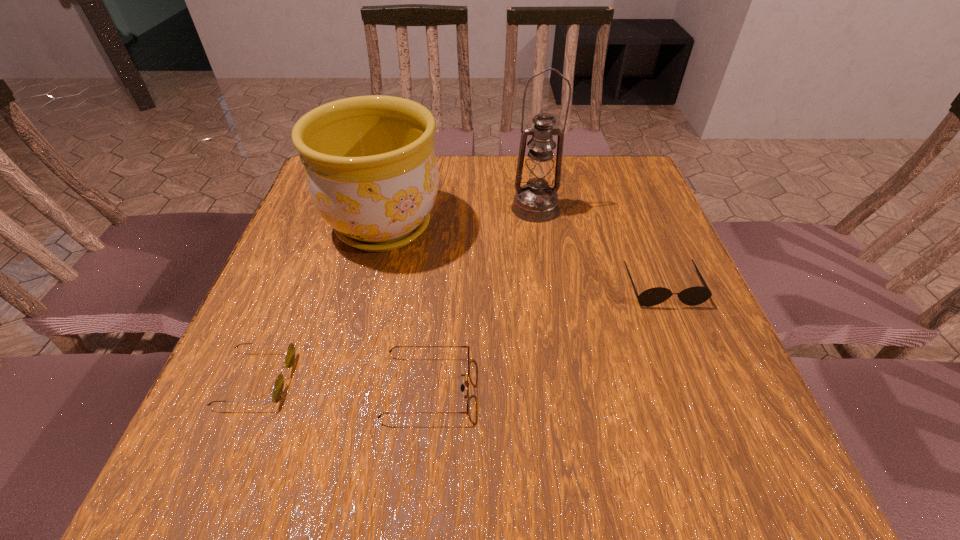
The width and height of the screenshot is (960, 540). Identify the location of free space located on the front-facing side of the second sunglasses from right to left. (533, 388).

Locate an element on the screen. Image resolution: width=960 pixels, height=540 pixels. free space located 0.330m on the front-facing side of the leftmost sunglasses is located at coordinates pyautogui.click(x=477, y=379).

What are the coordinates of `oil lamp positioned at the far edge` in the screenshot? It's located at (536, 202).

Where is `flowerpot at the far edge`? The width and height of the screenshot is (960, 540). flowerpot at the far edge is located at coordinates (370, 166).

Find the location of a particular element. flowerpot that is at the left edge is located at coordinates (370, 166).

Locate an element on the screen. sunglasses present at the left edge is located at coordinates (277, 392).

You are a GUI agent. You are given a task and a screenshot of the screen. Output one action in this format:
    pyautogui.click(x=<x>, y=<y>)
    Task: Click on the object that is at the right edge
    The image size is (960, 540).
    Given the screenshot: What is the action you would take?
    pyautogui.click(x=692, y=296)

At what (x,y) coordinates should I click in order to perform the action: click on object positioned at the far left corner. Please return your answer as a coordinate pair (x, y). Image resolution: width=960 pixels, height=540 pixels. Looking at the image, I should click on (370, 166).

Find the location of `vacant space at the far edge of the desktop`. vacant space at the far edge of the desktop is located at coordinates [x=524, y=164].

You are a GUI agent. You are given a task and a screenshot of the screen. Output one action in this format:
    pyautogui.click(x=<x>, y=<y>)
    Task: Click on the free space at the near edge of the desktop
    The width and height of the screenshot is (960, 540).
    Given the screenshot: What is the action you would take?
    point(555,462)